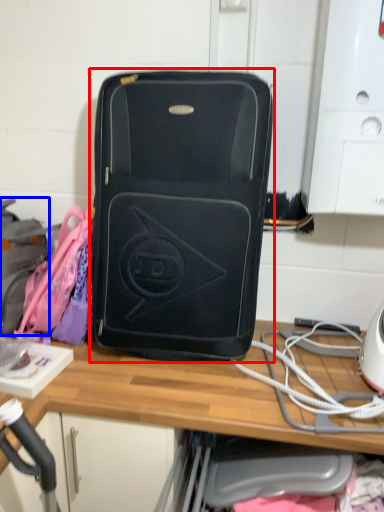
Question: Which point is closer to the camera, luggage and bags (highlighted by a red box) or luggage (highlighted by a blue box)?

Choices:
 (A) luggage and bags
 (B) luggage

Answer: (A)